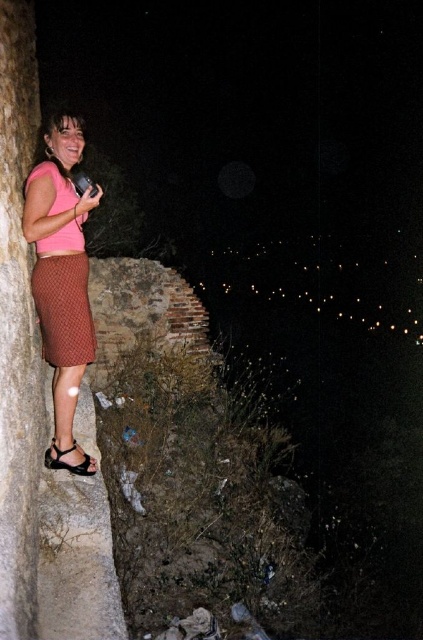
Question: Based on their relative distances, which object is farther from the black leather sandal at lower left?

Choices:
 (A) brown textured dress at left
 (B) pink fabric skirt at left

Answer: (A)

Question: Which is nearer to the black leather sandal at lower left?

Choices:
 (A) brown textured dress at left
 (B) pink fabric skirt at left

Answer: (B)

Question: Where is pink fabric skirt at left located in relation to brown textured dress at left in the image?

Choices:
 (A) left
 (B) right

Answer: (B)

Question: Does brown textured dress at left appear over black leather sandal at lower left?

Choices:
 (A) no
 (B) yes

Answer: (B)

Question: Does pink fabric skirt at left have a greater width compared to black leather sandal at lower left?

Choices:
 (A) no
 (B) yes

Answer: (B)

Question: Which object is closer to the camera taking this photo?

Choices:
 (A) pink fabric skirt at left
 (B) black leather sandal at lower left

Answer: (A)